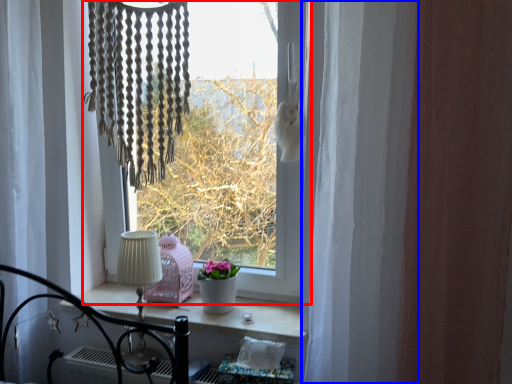
Question: Which of the following is the closest to the observer, window (highlighted by a red box) or curtain (highlighted by a blue box)?

Choices:
 (A) window
 (B) curtain

Answer: (B)